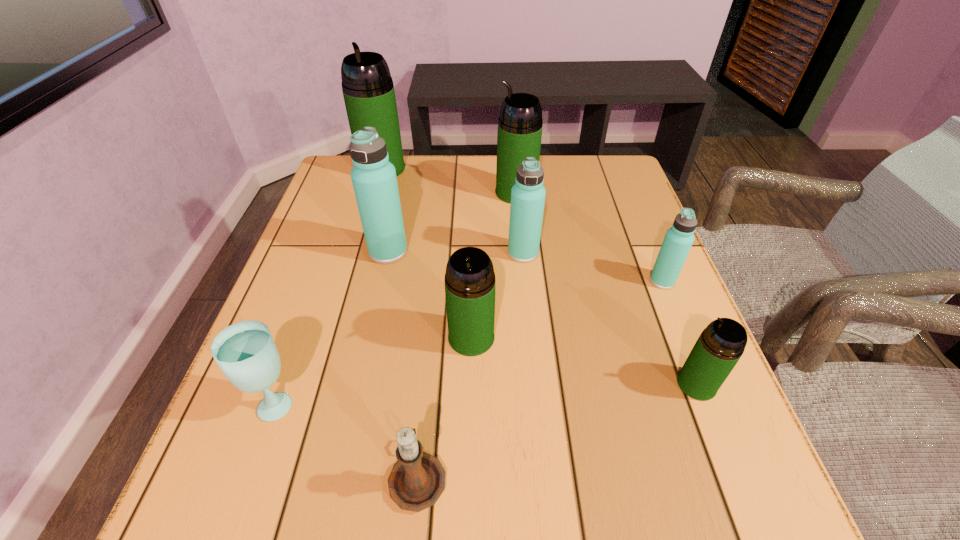
What are the coordinates of `the tallest object` in the screenshot? It's located at (367, 86).

Image resolution: width=960 pixels, height=540 pixels. What are the coordinates of `the leftmost green thermos bottle` in the screenshot? It's located at (367, 86).

Locate an element on the screen. This screenshot has width=960, height=540. the second green thermos bottle from right to left is located at coordinates tap(520, 123).

Find the location of a particular element. the biggest aqua thermos bottle is located at coordinates (374, 180).

What are the coordinates of `the third biggest green thermos bottle` in the screenshot? It's located at (470, 283).

Locate an element on the screen. This screenshot has height=540, width=960. the sixth farthest thermos bottle is located at coordinates (470, 283).

At what (x,y) coordinates should I click in order to perform the action: click on the second biggest aqua thermos bottle. Please return your answer as a coordinate pair (x, y). This screenshot has width=960, height=540. Looking at the image, I should click on (528, 194).

Locate an element on the screen. the nearest aqua thermos bottle is located at coordinates coord(678,240).

Identify the location of the rightmost aqua thermos bottle. (678, 240).

Image resolution: width=960 pixels, height=540 pixels. What are the coordinates of `the nearest thermos bottle` in the screenshot? It's located at (721, 344).